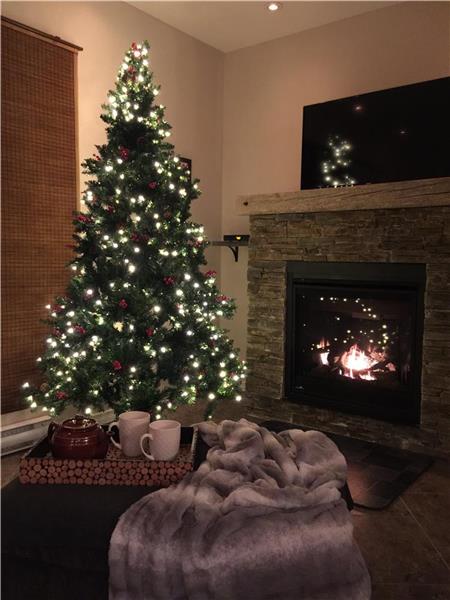
You are a GUI agent. You are given a task and a screenshot of the screen. Output one action in this format:
    pyautogui.click(x=<x>, y=<y>)
    Task: Click on the fireplace
    The width and height of the screenshot is (450, 600).
    Given the screenshot: What is the action you would take?
    368,357